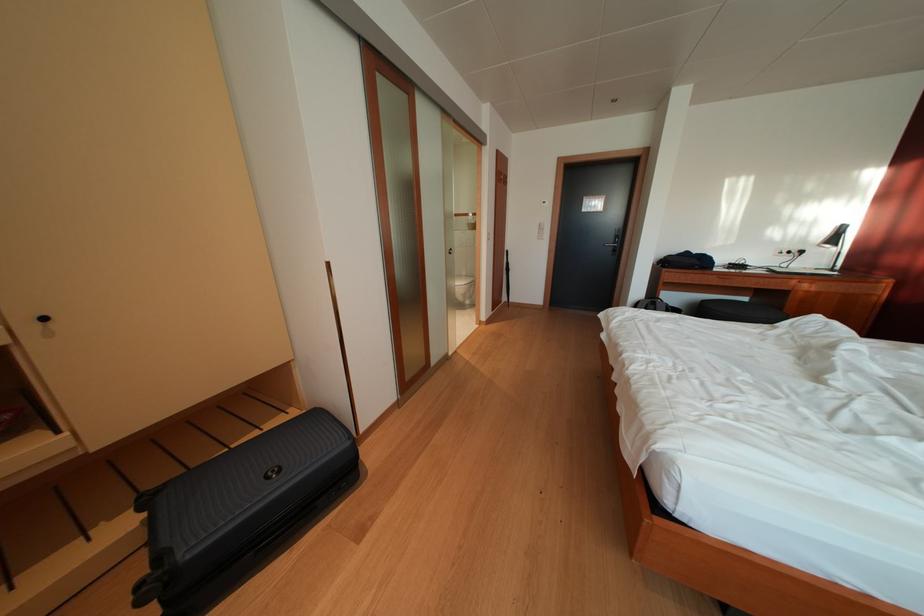
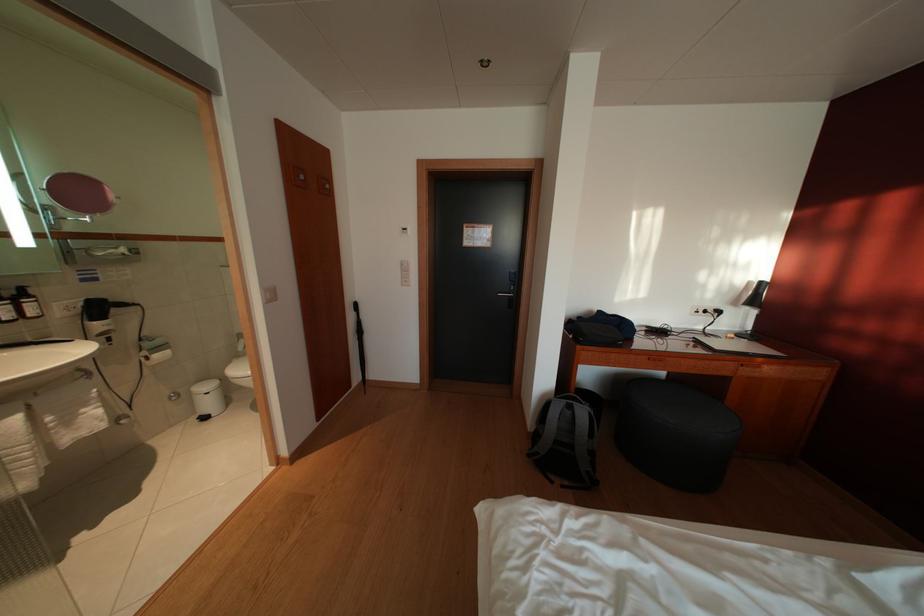
In a continuous first-person perspective shot, in which direction is the camera moving?

The movement direction of the cameraman is right, forward.